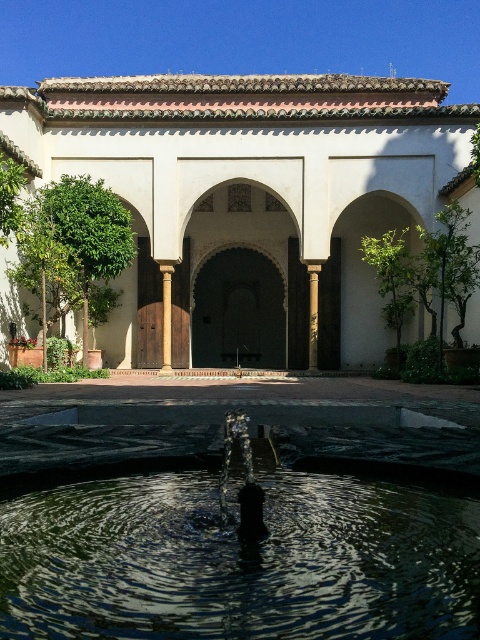
Can you confirm if white stucco palace at center is smaller than smooth stone pillar at center?

No.

Is point (343, 118) more distant than point (312, 332)?

Yes, it is.

You are a GUI agent. You are given a task and a screenshot of the screen. Output one action in this format:
    pyautogui.click(x=<x>, y=<y>)
    Task: Click on the white stucco palace at center
    
    Given the screenshot: What is the action you would take?
    pyautogui.click(x=249, y=198)

Can you confirm if dark stone archway at center is thinner than smooth stone pillar at center?

In fact, dark stone archway at center might be wider than smooth stone pillar at center.

Can you confirm if dark stone archway at center is positioned to the right of smooth stone pillar at center?

No, dark stone archway at center is not to the right of smooth stone pillar at center.

Which is behind, point (229, 324) or point (312, 342)?

The point (229, 324) is behind.

Identify the location of dark stone archway at center. The image size is (480, 640). (239, 310).

Is point (226, 257) closer to viewer compared to point (168, 301)?

No, it is not.

Can you confirm if dark stone archway at center is wider than brown stone column at center?

Yes, dark stone archway at center is wider than brown stone column at center.

Does point (194, 305) come in front of point (166, 275)?

No, (194, 305) is further to viewer.

The width and height of the screenshot is (480, 640). What are the coordinates of `dark stone archway at center` in the screenshot? It's located at (239, 310).